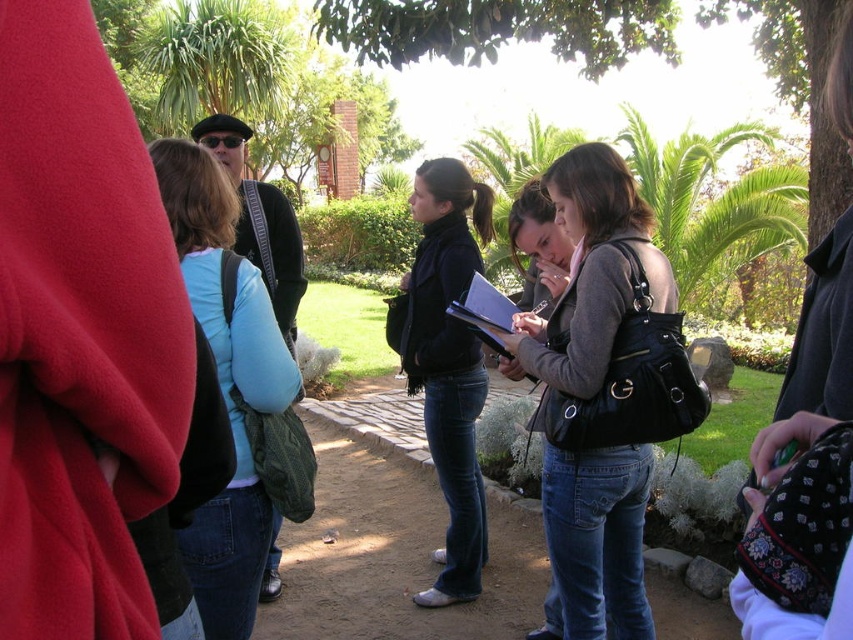
Question: Can you confirm if light blue sweater at center is smaller than black matte scarf at center?

Choices:
 (A) no
 (B) yes

Answer: (B)

Question: Which object is farther from the camera taking this photo?

Choices:
 (A) black matte scarf at center
 (B) matte black purse at center

Answer: (A)

Question: Is matte black purse at center wider than black matte scarf at center?

Choices:
 (A) no
 (B) yes

Answer: (B)

Question: Is light blue sweater at center below black matte scarf at center?

Choices:
 (A) yes
 (B) no

Answer: (B)

Question: Among these points, which one is nearest to the camera?

Choices:
 (A) (247, 516)
 (B) (440, 179)

Answer: (A)

Question: Among these objects, which one is nearest to the camera?

Choices:
 (A) black matte scarf at center
 (B) matte black purse at center
 (C) light blue sweater at center

Answer: (C)